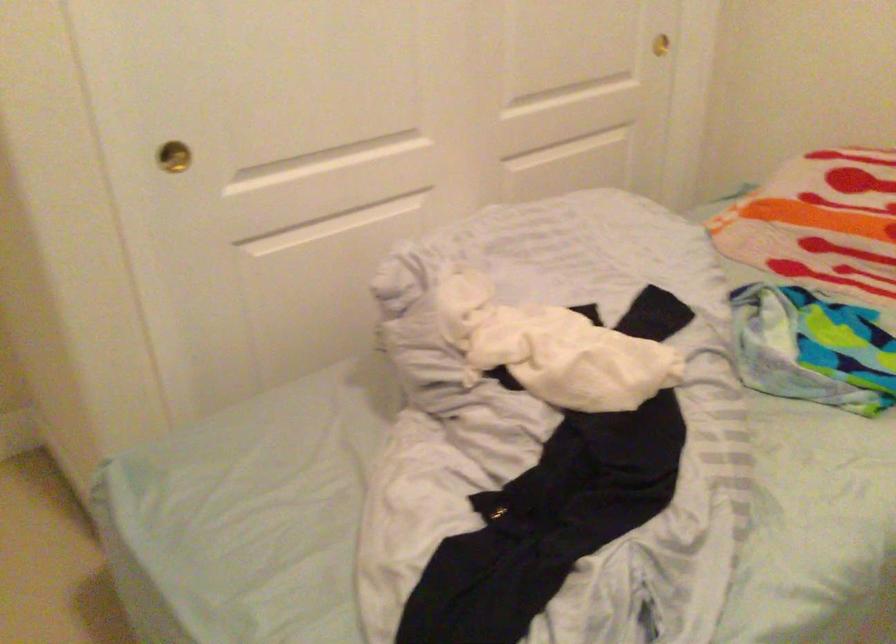
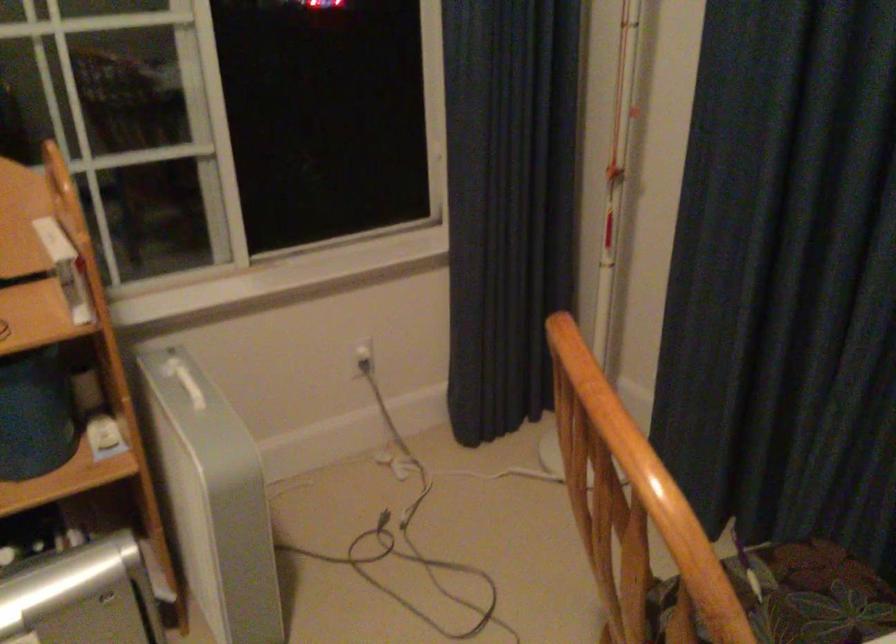
The images are taken continuously from a first-person perspective. In which direction is your viewpoint rotating?

The rotation direction of the camera is right-down.